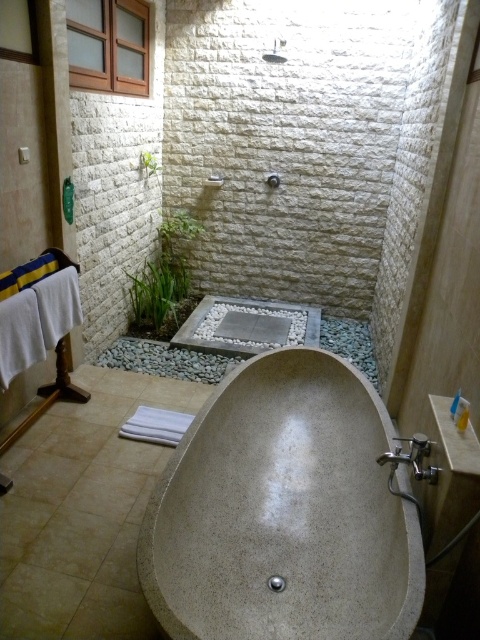
Question: Does matte stone bathtub at center have a larger size compared to satin nickel faucet at lower right?

Choices:
 (A) no
 (B) yes

Answer: (B)

Question: Is matte stone bathtub at center smaller than satin nickel faucet at lower right?

Choices:
 (A) no
 (B) yes

Answer: (A)

Question: Does matte stone bathtub at center have a lesser width compared to satin nickel faucet at lower right?

Choices:
 (A) no
 (B) yes

Answer: (A)

Question: Among these objects, which one is farthest from the camera?

Choices:
 (A) satin nickel faucet at lower right
 (B) matte stone bathtub at center

Answer: (A)